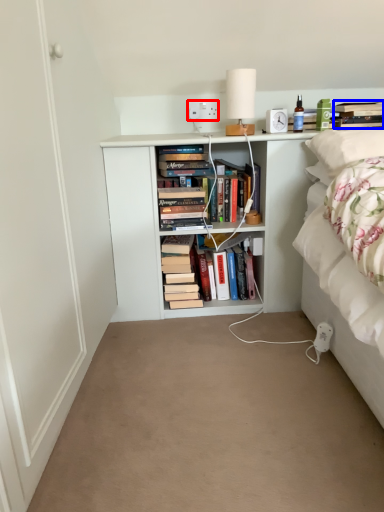
Question: Among these objects, which one is nearest to the camera, electric outlet (highlighted by a red box) or book (highlighted by a blue box)?

Choices:
 (A) electric outlet
 (B) book

Answer: (B)